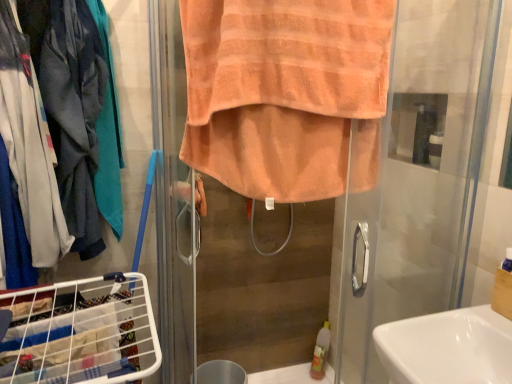
Question: Considering the relative positions of orange terry towel at center and white wire laundry basket at lower left in the image provided, is orange terry towel at center to the left of white wire laundry basket at lower left from the viewer's perspective?

Choices:
 (A) no
 (B) yes

Answer: (A)

Question: From the image's perspective, is orange terry towel at center over white wire laundry basket at lower left?

Choices:
 (A) yes
 (B) no

Answer: (A)

Question: Can you confirm if orange terry towel at center is thinner than white wire laundry basket at lower left?

Choices:
 (A) yes
 (B) no

Answer: (B)

Question: Is white wire laundry basket at lower left located within orange terry towel at center?

Choices:
 (A) yes
 (B) no

Answer: (B)

Question: Is orange terry towel at center shorter than white wire laundry basket at lower left?

Choices:
 (A) yes
 (B) no

Answer: (B)

Question: Is point (2, 306) positioned closer to the camera than point (475, 365)?

Choices:
 (A) closer
 (B) farther

Answer: (B)

Question: In terms of height, does white wire laundry basket at lower left look taller or shorter compared to white glossy sink at lower right?

Choices:
 (A) short
 (B) tall

Answer: (B)

Question: Considering the relative positions of white wire laundry basket at lower left and white glossy sink at lower right in the image provided, is white wire laundry basket at lower left to the left or to the right of white glossy sink at lower right?

Choices:
 (A) left
 (B) right

Answer: (A)

Question: In terms of size, does white wire laundry basket at lower left appear bigger or smaller than white glossy sink at lower right?

Choices:
 (A) big
 (B) small

Answer: (B)

Question: Choose the correct answer: Is white wire laundry basket at lower left inside orange towel at center or outside it?

Choices:
 (A) outside
 (B) inside

Answer: (A)

Question: Is white wire laundry basket at lower left taller or shorter than orange towel at center?

Choices:
 (A) tall
 (B) short

Answer: (B)

Question: In the image, is white wire laundry basket at lower left positioned in front of or behind orange towel at center?

Choices:
 (A) behind
 (B) front

Answer: (A)

Question: Is white wire laundry basket at lower left bigger or smaller than orange towel at center?

Choices:
 (A) big
 (B) small

Answer: (B)

Question: Relative to white glossy sink at lower right, is matte gray jacket at left in front or behind?

Choices:
 (A) behind
 (B) front

Answer: (A)

Question: Is matte gray jacket at left taller or shorter than white glossy sink at lower right?

Choices:
 (A) short
 (B) tall

Answer: (B)